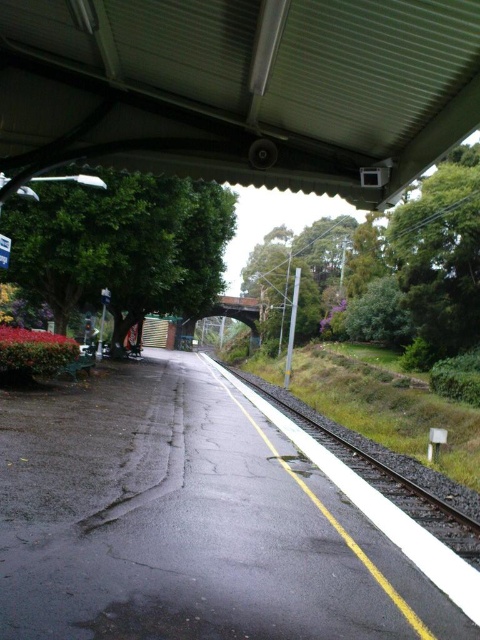
Based on the photo, you are standing at the edge of the train station platform. Looking up, you see the green corrugated metal canopy at upper center. What is the 2D coordinate of its position?

The 2D coordinate of the green corrugated metal canopy at upper center is at point (240, 88).

You are waiting for a train at the station. You see the green corrugated metal canopy at upper center and the black asphalt train track at lower right. Which object is closer to you from your position on the platform?

The green corrugated metal canopy at upper center is closer to you because it is in front of the black asphalt train track at lower right.